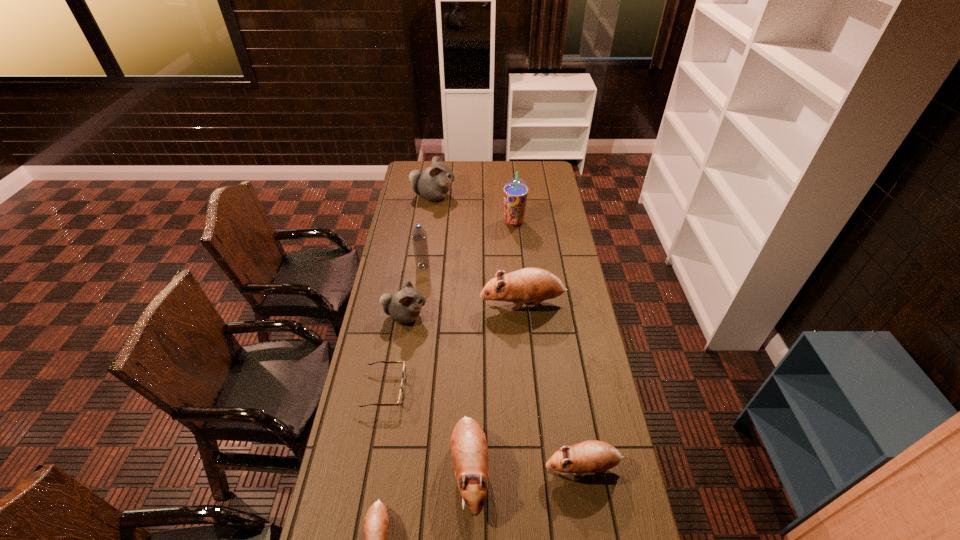
The image size is (960, 540). What are the coordinates of `brown hamster that is the second closest to the tallest object` in the screenshot? It's located at (469, 452).

Find the location of `brown hamster object that ranks as the third closest to the second biggest brown hamster`. brown hamster object that ranks as the third closest to the second biggest brown hamster is located at coordinates (528, 284).

The image size is (960, 540). I want to click on vacant space that satisfies the following two spatial constraints: 1. at the face of the second smallest brown hamster; 2. at the face of the third smallest brown hamster, so click(x=584, y=470).